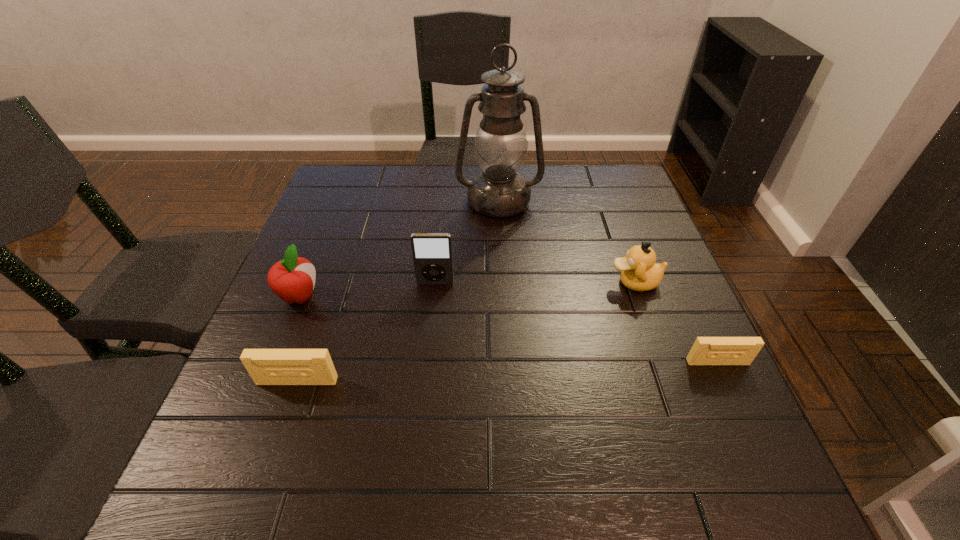
To make them evenly spaced by inserting another videotape among them, please locate a vacant spot for this new videotape. Please provide its 2D coordinates. Your answer should be formatted as a tuple, i.e. [(x, y)], where the tuple contains the x and y coordinates of a point satisfying the conditions above.

[(512, 372)]